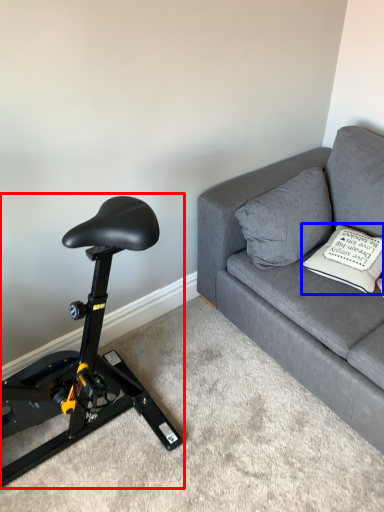
Question: Among these objects, which one is farthest to the camera, stationary bicycle (highlighted by a red box) or pillow (highlighted by a blue box)?

Choices:
 (A) stationary bicycle
 (B) pillow

Answer: (B)